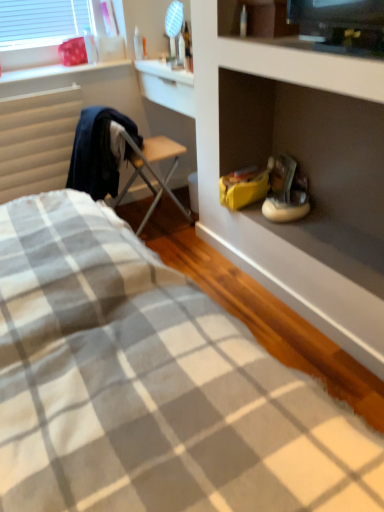
Question: Can you confirm if gray checkered fabric at lower left is thinner than white matte sneakers at center-right?

Choices:
 (A) yes
 (B) no

Answer: (B)

Question: From the image's perspective, is gray checkered fabric at lower left beneath white matte sneakers at center-right?

Choices:
 (A) no
 (B) yes

Answer: (B)

Question: Is gray checkered fabric at lower left bigger than white matte sneakers at center-right?

Choices:
 (A) yes
 (B) no

Answer: (A)

Question: From a real-world perspective, does gray checkered fabric at lower left stand above white matte sneakers at center-right?

Choices:
 (A) yes
 (B) no

Answer: (B)

Question: Is gray checkered fabric at lower left wider than white matte sneakers at center-right?

Choices:
 (A) no
 (B) yes

Answer: (B)

Question: Is wooden folding chair at center to the left or to the right of beige fabric radiator at left in the image?

Choices:
 (A) right
 (B) left

Answer: (A)

Question: From the image's perspective, is wooden folding chair at center positioned above or below beige fabric radiator at left?

Choices:
 (A) above
 (B) below

Answer: (B)

Question: Is point (175, 159) closer or farther from the camera than point (19, 175)?

Choices:
 (A) closer
 (B) farther

Answer: (B)

Question: In the image, is wooden folding chair at center positioned in front of or behind beige fabric radiator at left?

Choices:
 (A) front
 (B) behind

Answer: (A)

Question: In the image, is white matte sneakers at center-right positioned in front of or behind beige fabric radiator at left?

Choices:
 (A) front
 (B) behind

Answer: (A)

Question: Is white matte sneakers at center-right bigger or smaller than beige fabric radiator at left?

Choices:
 (A) small
 (B) big

Answer: (A)

Question: Does point (301, 198) appear closer or farther from the camera than point (51, 119)?

Choices:
 (A) closer
 (B) farther

Answer: (A)

Question: From the image's perspective, is white matte sneakers at center-right positioned above or below beige fabric radiator at left?

Choices:
 (A) below
 (B) above

Answer: (A)

Question: Based on their sizes in the image, would you say beige fabric radiator at left is bigger or smaller than white painted wood at upper left?

Choices:
 (A) small
 (B) big

Answer: (B)

Question: Does point (56, 92) appear closer or farther from the camera than point (26, 76)?

Choices:
 (A) farther
 (B) closer

Answer: (A)